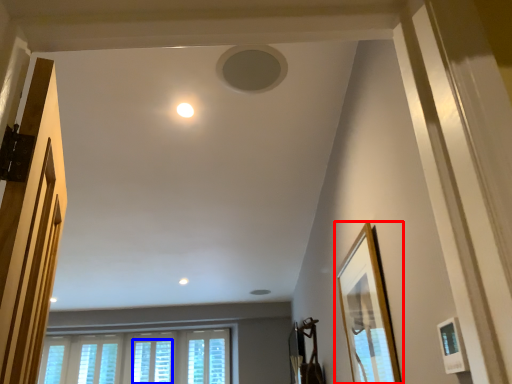
Question: Among these objects, which one is farthest to the camera, picture frame (highlighted by a red box) or window (highlighted by a blue box)?

Choices:
 (A) picture frame
 (B) window

Answer: (B)